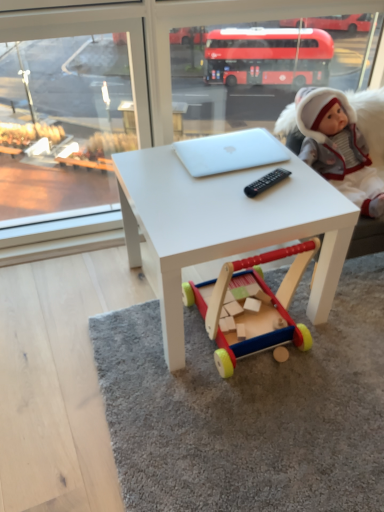
This screenshot has width=384, height=512. I want to click on free space to the left of white matte laptop at center, so click(150, 166).